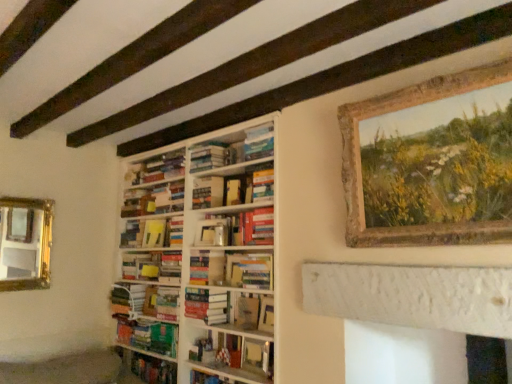
In order to click on empty space that is ontop of gold-framed mirror at lower left in this screenshot , I will do `click(32, 198)`.